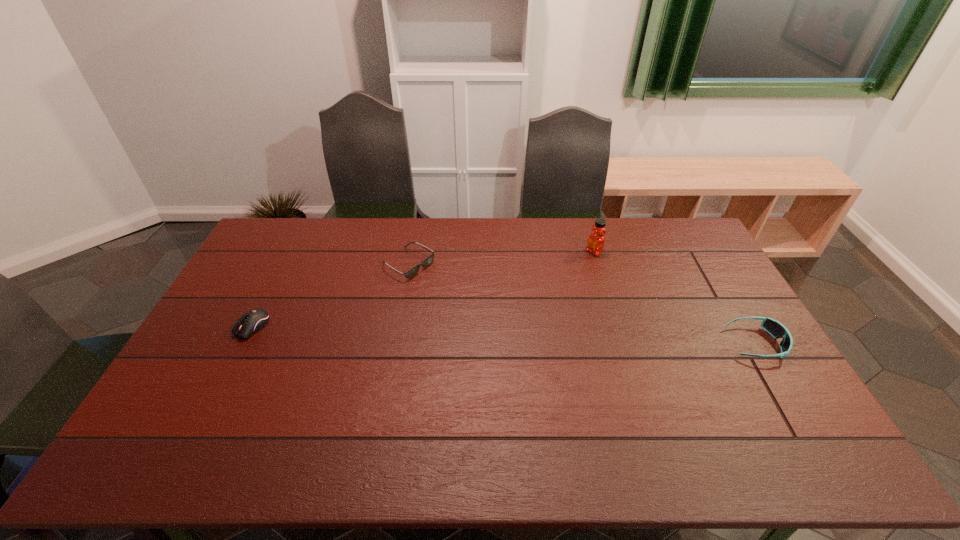
The height and width of the screenshot is (540, 960). Identify the location of free space at the right edge of the desktop. (719, 272).

In the image, there is a desktop. At what (x,y) coordinates should I click in order to perform the action: click on free space at the far left corner. Please return your answer as a coordinate pair (x, y). The height and width of the screenshot is (540, 960). Looking at the image, I should click on (303, 233).

In the image, there is a desktop. Find the location of `free space at the far right corner`. free space at the far right corner is located at coordinates (679, 246).

Where is `free spot between the honey and the leftmost object`? This screenshot has width=960, height=540. free spot between the honey and the leftmost object is located at coordinates pyautogui.click(x=423, y=289).

The image size is (960, 540). I want to click on free space between the leftmost object and the tallest object, so click(423, 289).

Locate an element on the screen. The height and width of the screenshot is (540, 960). vacant point located between the left sunglasses and the nearer sunglasses is located at coordinates (582, 304).

Identify the location of unoccupied position between the leftmost object and the honey. (423, 289).

Find the location of a particular element. Image resolution: width=960 pixels, height=540 pixels. free space between the taller sunglasses and the farther sunglasses is located at coordinates tap(582, 304).

Where is `free space between the second object from right to left and the taller sunglasses`? The image size is (960, 540). free space between the second object from right to left and the taller sunglasses is located at coordinates click(x=675, y=298).

The image size is (960, 540). Identify the location of vacant space in between the honey and the left sunglasses. (501, 258).